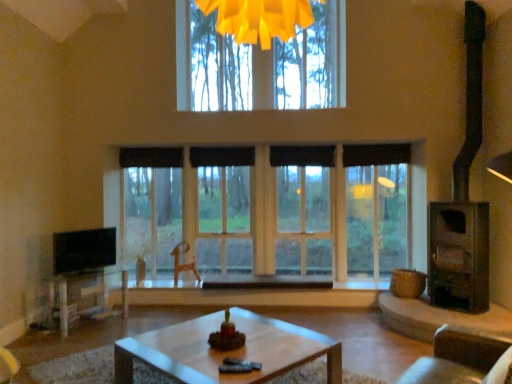
Question: From the image's perspective, is black glossy tv at left located above or below black fabric curtain at center, which is the 3th curtain in left-to-right order?

Choices:
 (A) below
 (B) above

Answer: (A)

Question: Is black glossy tv at left wider or thinner than black fabric curtain at center, marked as the 2th curtain in a right-to-left arrangement?

Choices:
 (A) wide
 (B) thin

Answer: (A)

Question: Considering the real-world distances, which object is closest to the translucent plastic swivel chair at center?

Choices:
 (A) white glossy coffee table at lower center
 (B) dark gray metallic fireplace at right
 (C) black fabric curtain at center, the 2th curtain from the left
 (D) black matte curtain at upper center, the 1th curtain viewed from the left
 (E) wooden coffee table at lower left

Answer: (D)

Question: Which object is positioned closest to the black fabric curtain at center, acting as the third curtain starting from the right?

Choices:
 (A) clear glass window at center
 (B) wooden coffee table at lower left
 (C) black matte curtain at upper center, the 1th curtain viewed from the left
 (D) black fabric curtain at upper center, positioned as the first curtain in right-to-left order
 (E) black fabric curtain at center, marked as the 2th curtain in a right-to-left arrangement

Answer: (C)